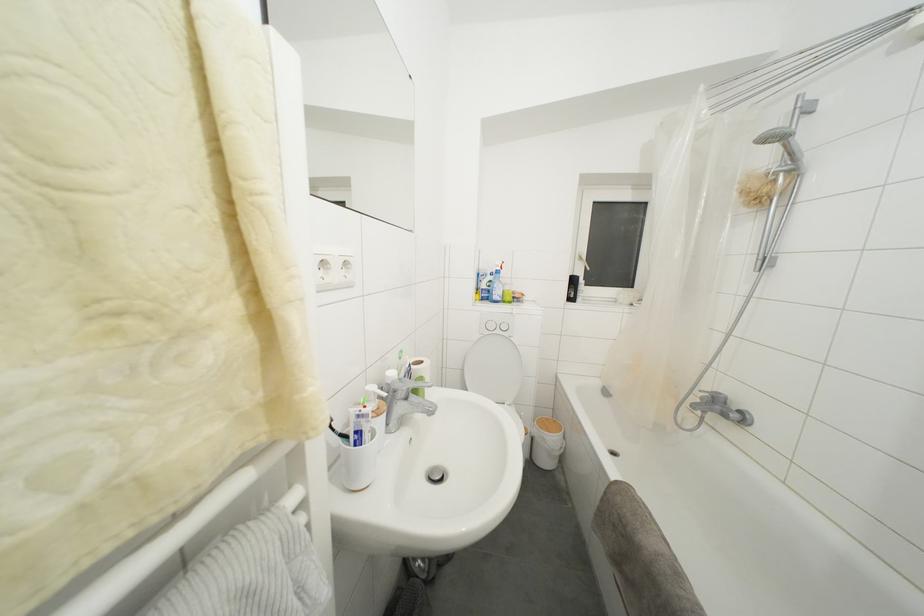
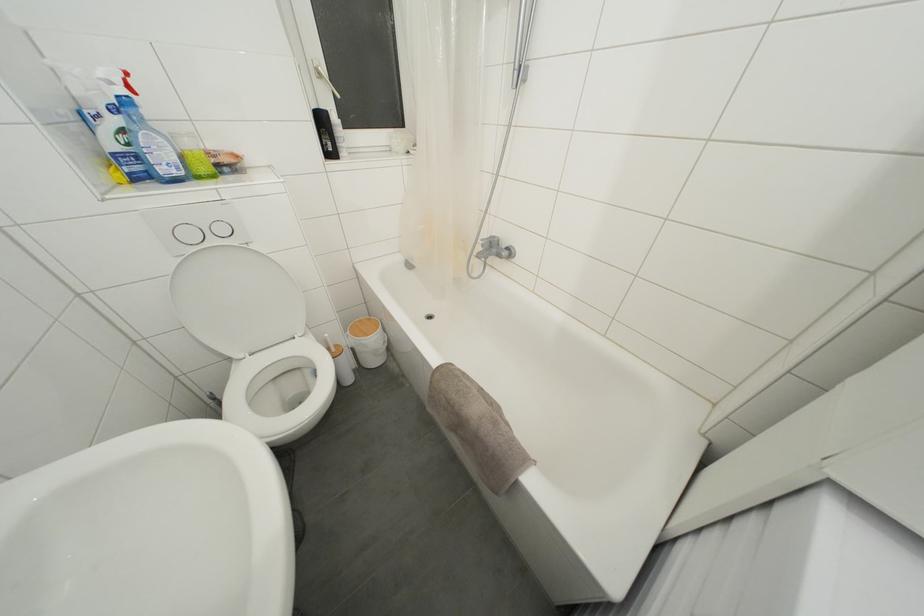
Where in the second image is the point corresponding to point (552, 424) from the first image?

(363, 326)